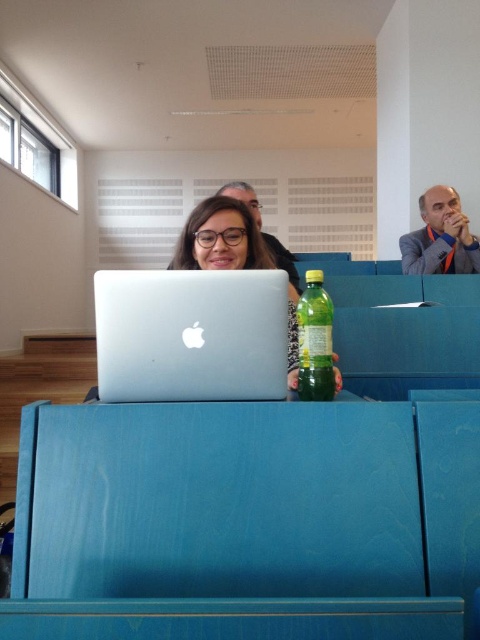
You are a photographer standing 1.5 meters away from the camera. You want to take a photo of the matte black man at upper right. Can you reach him within your current position without moving?

The matte black man at upper right is 3.03 meters from camera. Since you are 1.5 meters away from the camera, the distance between you and the matte black man at upper right is 1.53 meters. Therefore, you can reach him without moving.

You are standing in the lecture hall and want to determine the relative positions of two points marked in the scene. Which of the two points, point 1 at coordinates (242,317) or point 2 at coordinates (451,236), is closer to you?

Point 1 at coordinates (242,317) is closer to the viewer than point 2 at coordinates (451,236).

You are a student who wants to place both the sleek silver laptop at center and the green translucent bottle at center on your desk. Given that your desk has limited space, which object should you prioritize placing first to ensure both fit?

The sleek silver laptop at center is wider than the green translucent bottle at center. Therefore, you should place the sleek silver laptop at center first to ensure both fit on the desk.